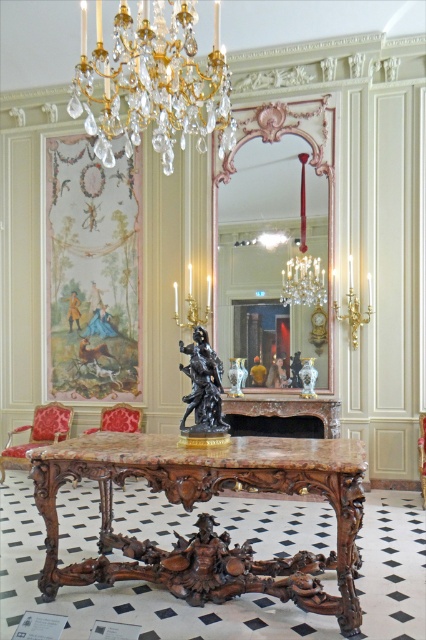
Question: Among these points, which one is nearest to the camera?

Choices:
 (A) [x=316, y=115]
 (B) [x=420, y=426]
 (C) [x=201, y=436]
 (D) [x=28, y=428]

Answer: (C)

Question: Is black polished marble statue at center bigger than velvet red chair at center?

Choices:
 (A) yes
 (B) no

Answer: (B)

Question: Which of the following is the closest to the observer?

Choices:
 (A) (207, 97)
 (B) (118, 424)

Answer: (A)

Question: Does crystal/glass chandelier at upper center appear over velvet red chair at center?

Choices:
 (A) yes
 (B) no

Answer: (A)

Question: In this image, where is crystal/glass chandelier at upper center located relative to velvet red chair at left?

Choices:
 (A) left
 (B) right

Answer: (B)

Question: Which object is farther from the camera taking this photo?

Choices:
 (A) velvet red chair at left
 (B) crystal/glass chandelier at upper center
 (C) black polished marble statue at center
 (D) pink gilded mirror at upper center

Answer: (A)